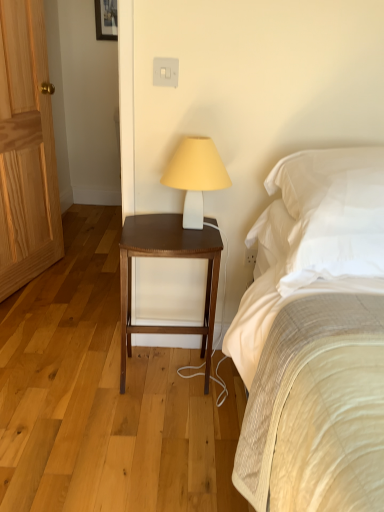
Identify the location of vacant space situated on the left part of white matte table lamp at upper center. (148, 226).